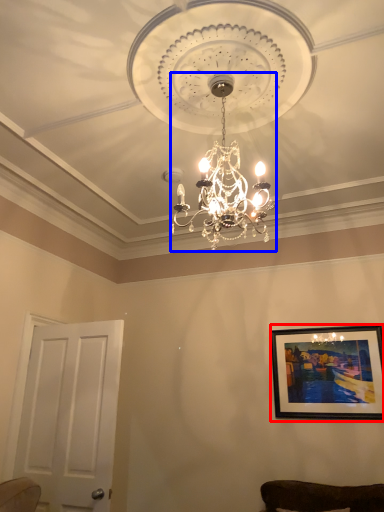
Question: Which point is closer to the camera, picture frame (highlighted by a red box) or lamp (highlighted by a blue box)?

Choices:
 (A) picture frame
 (B) lamp

Answer: (B)